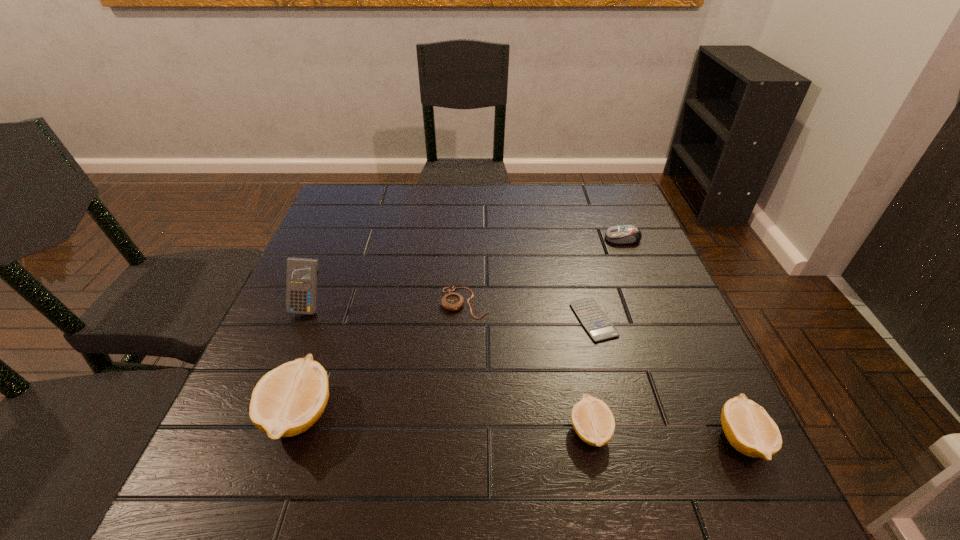
Identify the location of vacant space that's between the computer mouse and the taller calculator. The height and width of the screenshot is (540, 960). (466, 273).

In order to click on vacant space that's between the pocket watch and the right calculator in this screenshot , I will do `click(529, 311)`.

This screenshot has height=540, width=960. I want to click on vacant area that lies between the third object from left to right and the taller calculator, so click(387, 305).

Image resolution: width=960 pixels, height=540 pixels. I want to click on free space between the tallest lemon and the second lemon from right to left, so click(x=444, y=422).

Select which object appears as the fourth closest to the shortest lemon. Please provide its 2D coordinates. Your answer should be formatted as a tuple, i.e. [(x, y)], where the tuple contains the x and y coordinates of a point satisfying the conditions above.

[(288, 400)]

Locate an element on the screen. the third closest object to the shortest object is located at coordinates (748, 427).

Find the location of a particular element. lemon object that ranks as the closest to the fifth object from right to left is located at coordinates point(288,400).

Identify the location of lemon that can be found as the third closest to the right calculator. The height and width of the screenshot is (540, 960). (288, 400).

Locate an element on the screen. The width and height of the screenshot is (960, 540). free space that satisfies the following two spatial constraints: 1. on the front side of the second shortest object; 2. on the right side of the second lemon from right to left is located at coordinates (461, 431).

This screenshot has width=960, height=540. I want to click on free region that satisfies the following two spatial constraints: 1. on the front-facing side of the left calculator; 2. on the right side of the third tallest object, so 254,440.